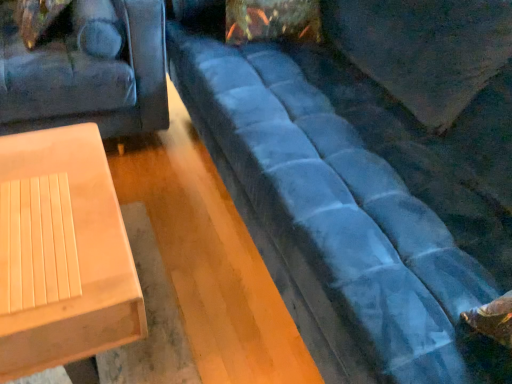
Where is `vacant point above light wood/texture table at lower left (from a real-world perspective)`? vacant point above light wood/texture table at lower left (from a real-world perspective) is located at coordinates (47, 216).